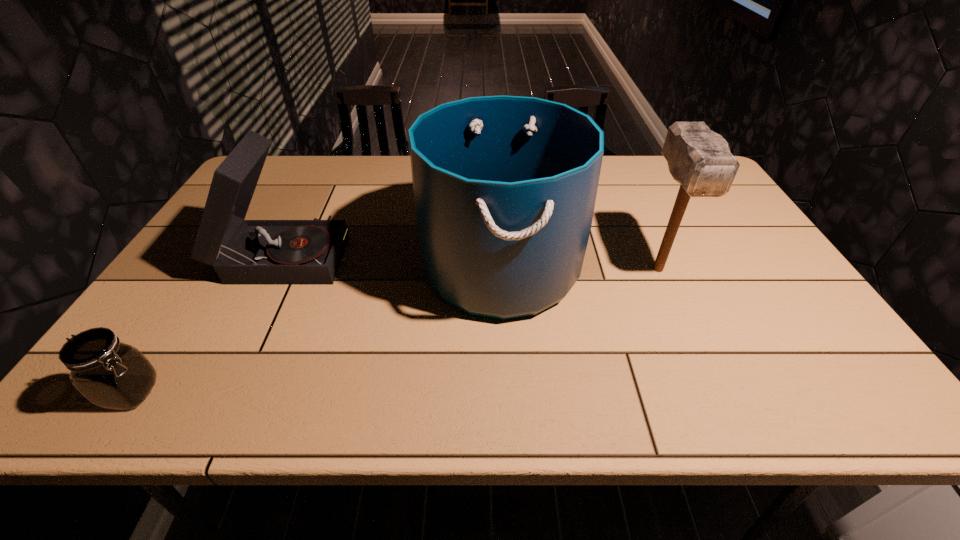
Locate an element on the screen. Image resolution: width=960 pixels, height=540 pixels. vacant space that satisfies the following two spatial constraints: 1. on the striking face of the mallet; 2. on the lid of the nearest object is located at coordinates (713, 393).